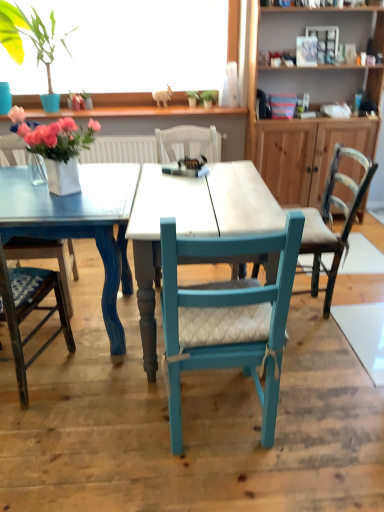
You are a GUI agent. You are given a task and a screenshot of the screen. Output one action in this format:
    pyautogui.click(x=<x>, y=<y>)
    Task: Click on the vacant space situated above white wood table at center (from a real-world perspective)
    
    Given the screenshot: What is the action you would take?
    pyautogui.click(x=208, y=197)